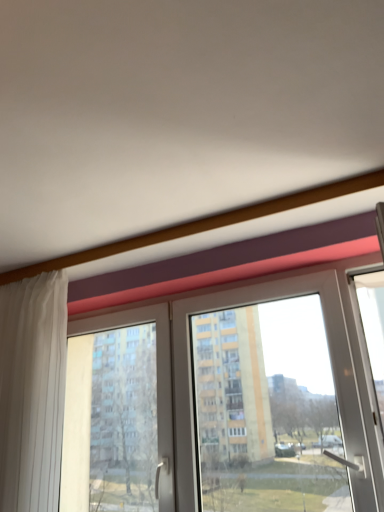
Question: Considering the relative sizes of transparent glass window at center and white sheer curtain at left in the image provided, is transparent glass window at center smaller than white sheer curtain at left?

Choices:
 (A) no
 (B) yes

Answer: (A)

Question: Is transparent glass window at center with white sheer curtain at left?

Choices:
 (A) yes
 (B) no

Answer: (B)

Question: Is transparent glass window at center completely or partially outside of white sheer curtain at left?

Choices:
 (A) no
 (B) yes

Answer: (B)

Question: Does transparent glass window at center have a larger size compared to white sheer curtain at left?

Choices:
 (A) no
 (B) yes

Answer: (B)

Question: Is transparent glass window at center facing towards white sheer curtain at left?

Choices:
 (A) yes
 (B) no

Answer: (B)

Question: Does transparent glass window at center lie in front of white sheer curtain at left?

Choices:
 (A) yes
 (B) no

Answer: (A)

Question: Considering the relative sizes of white sheer curtain at left and transparent glass window at center in the image provided, is white sheer curtain at left shorter than transparent glass window at center?

Choices:
 (A) no
 (B) yes

Answer: (A)

Question: Is white sheer curtain at left bigger than transparent glass window at center?

Choices:
 (A) no
 (B) yes

Answer: (A)

Question: Is white sheer curtain at left at the right side of transparent glass window at center?

Choices:
 (A) no
 (B) yes

Answer: (A)

Question: From a real-world perspective, is white sheer curtain at left on top of transparent glass window at center?

Choices:
 (A) no
 (B) yes

Answer: (B)

Question: From a real-world perspective, is white sheer curtain at left below transparent glass window at center?

Choices:
 (A) no
 (B) yes

Answer: (A)

Question: Is white sheer curtain at left positioned in front of transparent glass window at center?

Choices:
 (A) yes
 (B) no

Answer: (B)

Question: Is point tap(294, 438) closer or farther from the camera than point tap(46, 419)?

Choices:
 (A) farther
 (B) closer

Answer: (A)